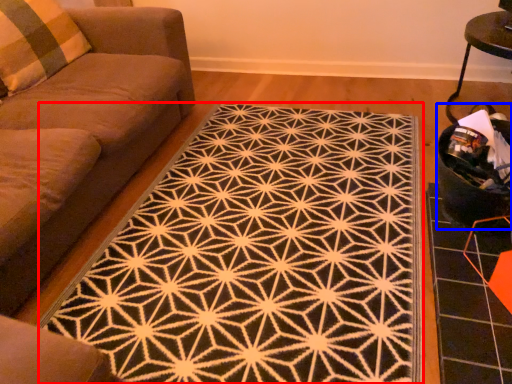
Question: Which of the following is the farthest to the observer, mat (highlighted by a red box) or swivel chair (highlighted by a blue box)?

Choices:
 (A) mat
 (B) swivel chair

Answer: (B)